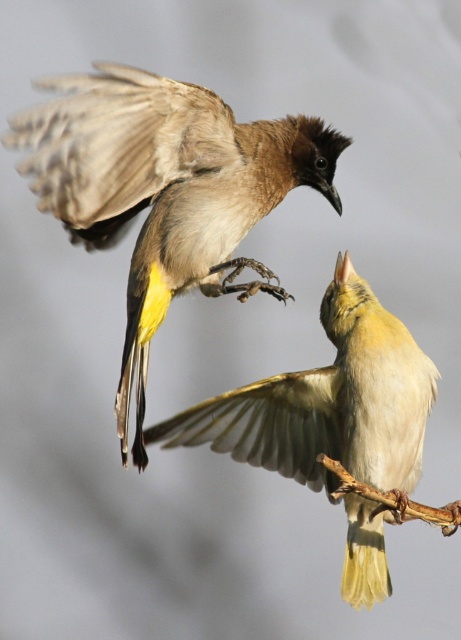
Question: Does brown feathered bird at upper center lie behind brown feathered wing at upper left?

Choices:
 (A) yes
 (B) no

Answer: (A)

Question: Does light brown feathered bird at center have a greater width compared to brown wood at lower right?

Choices:
 (A) no
 (B) yes

Answer: (B)

Question: Which is farther from the brown feathered bird at upper center?

Choices:
 (A) light brown feathered bird at center
 (B) brown wood at lower right
 (C) brown feathered wing at upper left

Answer: (B)

Question: Is brown feathered bird at upper center below brown wood at lower right?

Choices:
 (A) no
 (B) yes

Answer: (A)

Question: Which of the following is the closest to the observer?

Choices:
 (A) (136, 106)
 (B) (285, 412)
 (C) (171, 134)
 (D) (358, 486)

Answer: (D)

Question: Which is nearer to the brown feathered bird at upper center?

Choices:
 (A) brown wood at lower right
 (B) light brown feathered bird at center

Answer: (B)